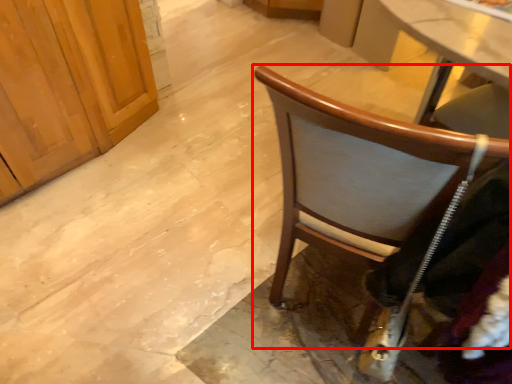
Question: Where is chair (annotated by the red box) located in relation to clothing in the image?

Choices:
 (A) left
 (B) right

Answer: (A)